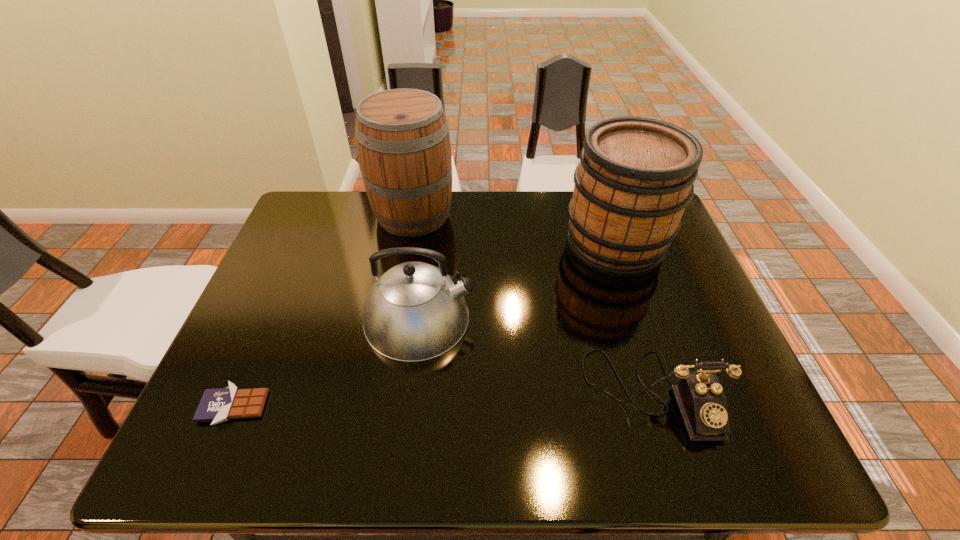
The width and height of the screenshot is (960, 540). I want to click on unoccupied area between the third tallest object and the telephone, so click(x=536, y=356).

Locate an element on the screen. vacant point located between the leftmost object and the telephone is located at coordinates (444, 400).

Image resolution: width=960 pixels, height=540 pixels. What are the coordinates of `empty location between the right cider and the kettle` in the screenshot? It's located at (517, 281).

At what (x,y) coordinates should I click in order to perform the action: click on vacant region between the leftmost object and the kettle. Please return your answer as a coordinate pair (x, y). Looking at the image, I should click on (326, 363).

Point out which object is positioned as the nearest to the third tallest object. Please provide its 2D coordinates. Your answer should be formatted as a tuple, i.e. [(x, y)], where the tuple contains the x and y coordinates of a point satisfying the conditions above.

[(402, 135)]

Identify which object is located as the nearest to the right cider. Please provide its 2D coordinates. Your answer should be formatted as a tuple, i.e. [(x, y)], where the tuple contains the x and y coordinates of a point satisfying the conditions above.

[(702, 403)]

I want to click on free space in the image that satisfies the following two spatial constraints: 1. on the front side of the left cider; 2. on the right side of the right cider, so click(x=408, y=245).

You are a GUI agent. You are given a task and a screenshot of the screen. Output one action in this format:
    pyautogui.click(x=<x>, y=<y>)
    Task: Click on the free space that satisfies the following two spatial constraints: 1. on the back side of the right cider; 2. on the right side of the leftmost object
    
    Given the screenshot: What is the action you would take?
    pyautogui.click(x=303, y=245)